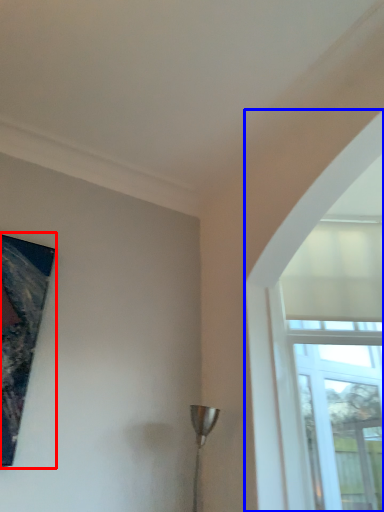
Question: Among these objects, which one is nearest to the camera, picture frame (highlighted by a red box) or window (highlighted by a blue box)?

Choices:
 (A) picture frame
 (B) window

Answer: (A)